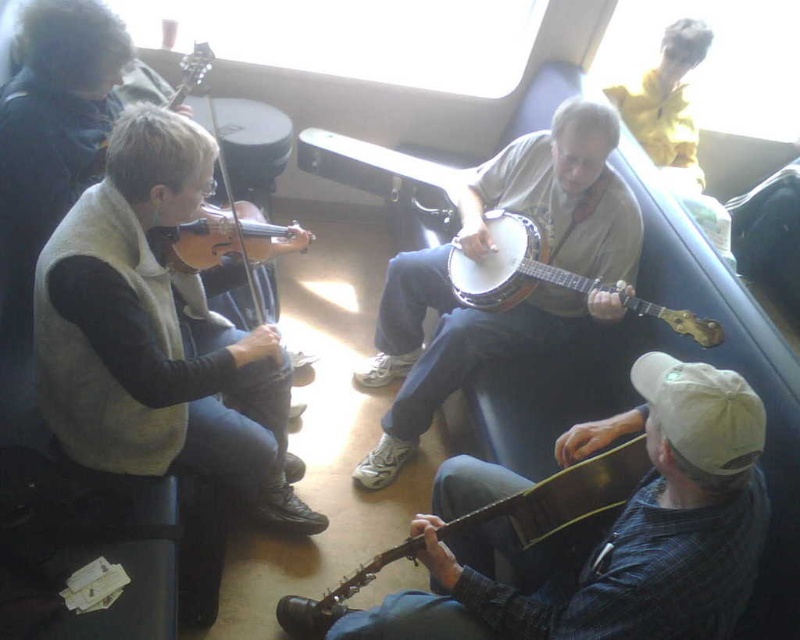
Between light brown wood banjo at center and wooden banjo at center, which one is positioned lower?

Positioned lower is light brown wood banjo at center.

Looking at this image, is light brown wood banjo at center below wooden banjo at center?

Correct, light brown wood banjo at center is located below wooden banjo at center.

Does point (482, 337) come farther from viewer compared to point (644, 308)?

That is True.

What are the coordinates of `light brown wood banjo at center` in the screenshot? It's located at (484, 253).

Who is taller, light brown wood banjo at center or white wooden banjo at center?

With more height is light brown wood banjo at center.

Does light brown wood banjo at center come behind white wooden banjo at center?

That is True.

Which is in front, point (546, 301) or point (670, 324)?

Point (670, 324) is more forward.

Image resolution: width=800 pixels, height=640 pixels. Find the location of `light brown wood banjo at center`. light brown wood banjo at center is located at coordinates (484, 253).

Consider the image. Who is positioned more to the right, white wooden banjo at center or wooden banjo at lower right?

white wooden banjo at center

Does white wooden banjo at center have a lesser width compared to wooden banjo at lower right?

Yes.

Is point (312, 140) more distant than point (518, 538)?

Yes, point (312, 140) is behind point (518, 538).

Where is `white wooden banjo at center`? Image resolution: width=800 pixels, height=640 pixels. white wooden banjo at center is located at coordinates (509, 266).